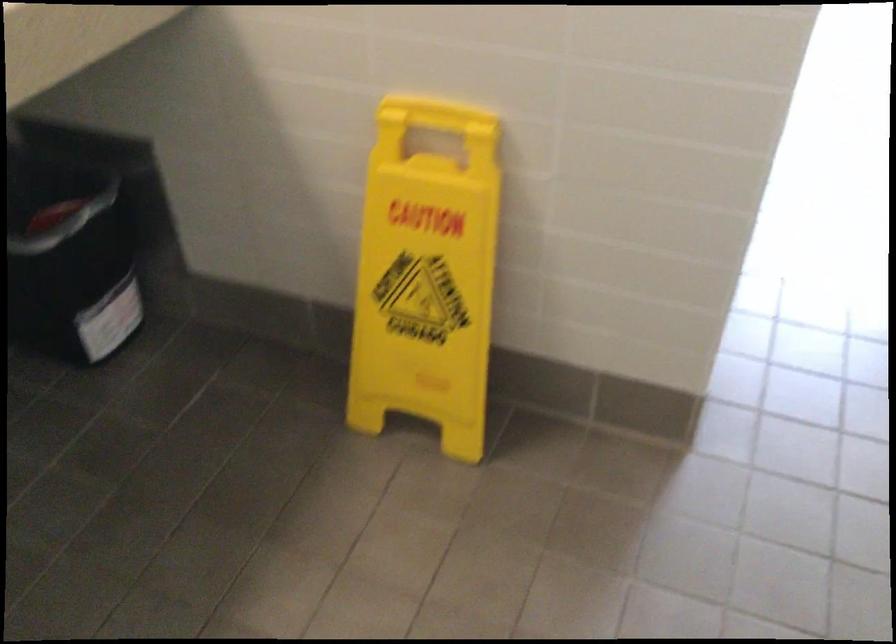
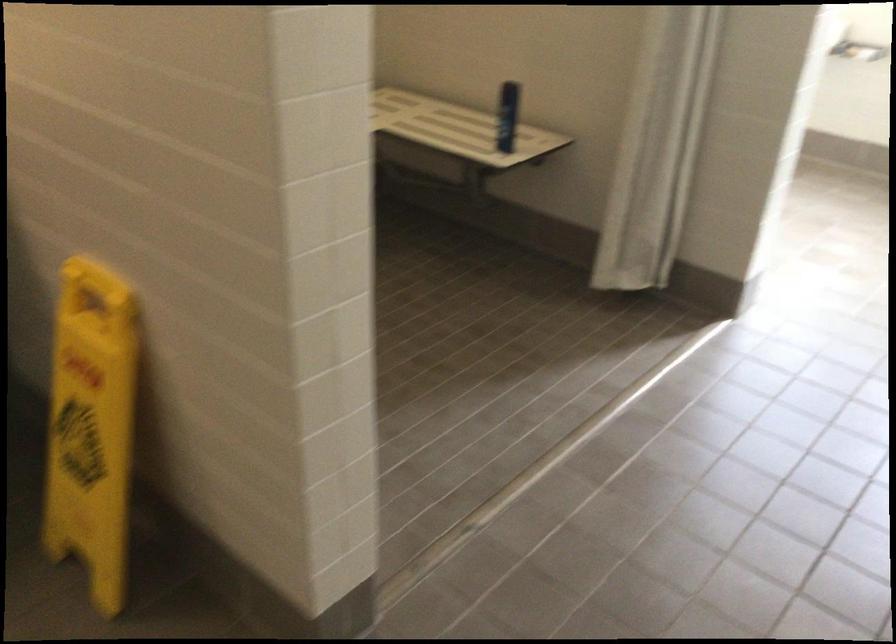
Question: The first image is from the beginning of the video and the second image is from the end. How did the camera likely rotate when shooting the video?

Choices:
 (A) Left
 (B) Right
 (C) Up
 (D) Down

Answer: (A)